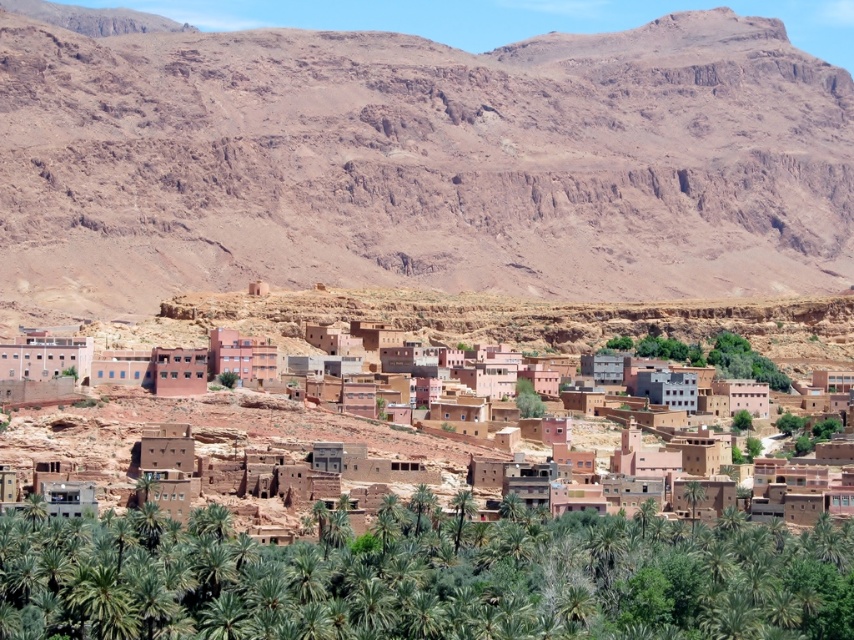
Question: Which of the following is the farthest from the observer?

Choices:
 (A) (785, 61)
 (B) (478, 532)
 (C) (202, 400)

Answer: (A)

Question: Does brown rocky mountain at upper center appear on the left side of green leafy palm trees at lower center?

Choices:
 (A) yes
 (B) no

Answer: (A)

Question: Can you confirm if green leafy palm trees at lower center is positioned below brown mudbrick buildings at center?

Choices:
 (A) yes
 (B) no

Answer: (A)

Question: Where is brown rocky mountain at upper center located in relation to brown mudbrick buildings at center in the image?

Choices:
 (A) above
 (B) below

Answer: (A)

Question: Among these objects, which one is farthest from the camera?

Choices:
 (A) brown mudbrick buildings at center
 (B) green leafy palm trees at lower center
 (C) brown rocky mountain at upper center

Answer: (C)

Question: Which point is farther from the camera taking this photo?

Choices:
 (A) (224, 458)
 (B) (676, 193)
 (C) (25, 525)

Answer: (B)